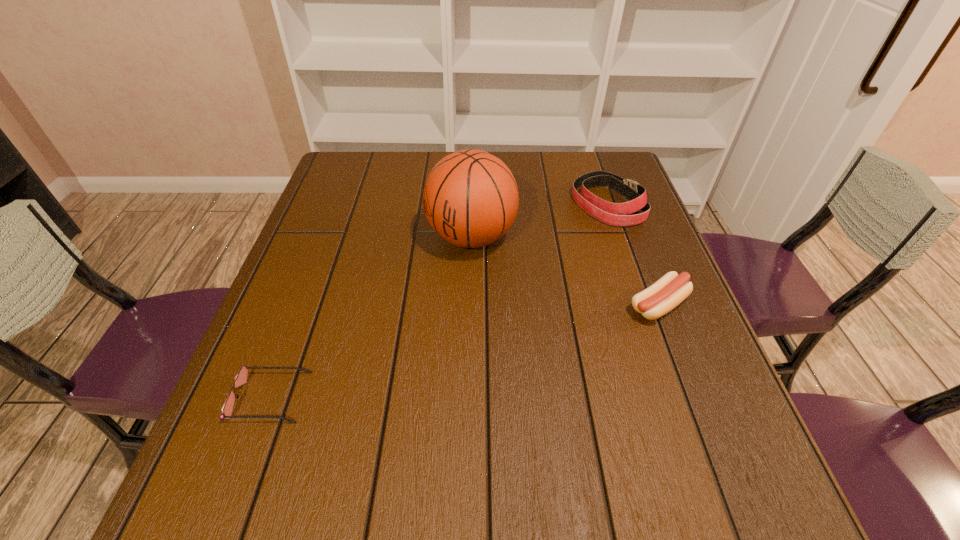
This screenshot has height=540, width=960. In order to click on basketball in this screenshot , I will do `click(470, 199)`.

The image size is (960, 540). I want to click on the tallest object, so click(470, 199).

Locate an element on the screen. This screenshot has height=540, width=960. the second tallest object is located at coordinates (616, 214).

Locate an element on the screen. sausage is located at coordinates (669, 291).

Identify the location of the third farthest object. (669, 291).

Where is `the leftmost object`? This screenshot has width=960, height=540. the leftmost object is located at coordinates (241, 378).

Where is `the shortest object`? the shortest object is located at coordinates (241, 378).

This screenshot has width=960, height=540. I want to click on free space located 0.300m on the left of the basketball, so click(310, 237).

This screenshot has width=960, height=540. Identify the location of free location located 0.270m on the front of the dog collar. (642, 306).

At what (x,y) coordinates should I click in order to perform the action: click on vacant space situated 0.270m on the back of the third tallest object. Please return your answer as a coordinate pair (x, y). Looking at the image, I should click on (623, 214).